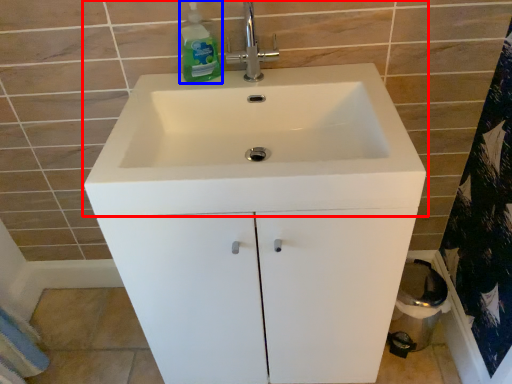
Question: Which of the following is the closest to the observer, sink (highlighted by a red box) or cleaning product (highlighted by a blue box)?

Choices:
 (A) sink
 (B) cleaning product

Answer: (A)